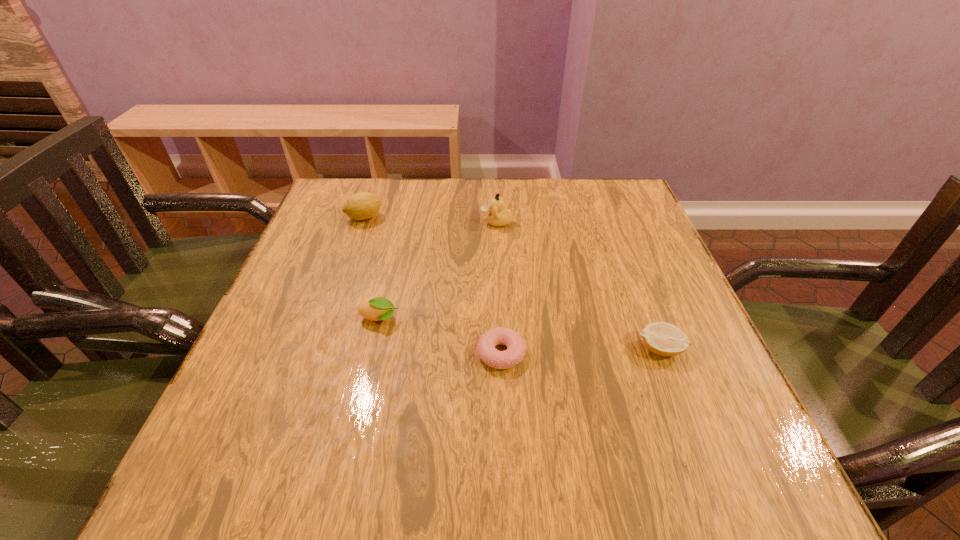
Where is `free space that satisfies the following two spatial constraints: 1. at the stem end of the second tallest object; 2. on the back side of the fourth tallest object`? Image resolution: width=960 pixels, height=540 pixels. free space that satisfies the following two spatial constraints: 1. at the stem end of the second tallest object; 2. on the back side of the fourth tallest object is located at coordinates (319, 349).

You are a GUI agent. You are given a task and a screenshot of the screen. Output one action in this format:
    pyautogui.click(x=<x>, y=<y>)
    Task: Click on the free point that satisfies the following two spatial constraints: 1. on the face of the duckling; 2. on the back side of the shortest lemon
    The image size is (960, 540).
    Given the screenshot: What is the action you would take?
    pyautogui.click(x=503, y=349)

The height and width of the screenshot is (540, 960). Identify the location of free space that satisfies the following two spatial constraints: 1. on the back side of the fourth tallest object; 2. on the face of the tallest object. click(x=612, y=222).

Find the location of a particular element. blank space that satisfies the following two spatial constraints: 1. on the back side of the shortest object; 2. on the left side of the rightmost object is located at coordinates (500, 349).

At what (x,y) coordinates should I click in order to perform the action: click on free space in the image that satisfies the following two spatial constraints: 1. on the face of the tallest object; 2. on the front side of the doughnut. Please return your answer as a coordinate pair (x, y). The image size is (960, 540). Looking at the image, I should click on (503, 354).

Locate an element on the screen. The width and height of the screenshot is (960, 540). free space that satisfies the following two spatial constraints: 1. on the face of the fourth tallest object; 2. on the right side of the duckling is located at coordinates (503, 349).

You are a GUI agent. You are given a task and a screenshot of the screen. Output one action in this format:
    pyautogui.click(x=<x>, y=<y>)
    Task: Click on the free space that satisfies the following two spatial constraints: 1. with leaves positioned above the doughnut; 2. on the right side of the second nearest lemon
    
    Given the screenshot: What is the action you would take?
    pyautogui.click(x=371, y=354)

Identify the location of vacant space that satisfies the following two spatial constraints: 1. with leaves positioned above the second lemon from left to right; 2. on the left side of the rightmost lemon. (372, 349).